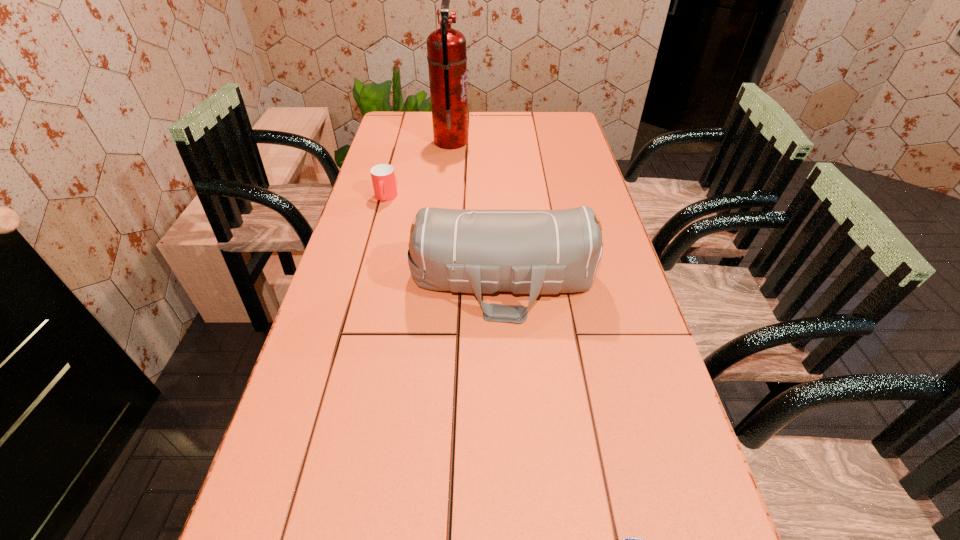
Select which object is the closest to the farthest object. Please provide its 2D coordinates. Your answer should be formatted as a tuple, i.e. [(x, y)], where the tuple contains the x and y coordinates of a point satisfying the conditions above.

[(383, 177)]

Where is `free space that satisfies the following two spatial constraints: 1. on the side of the farthest object with the handle and hose; 2. on the right side of the third shortest object`? Image resolution: width=960 pixels, height=540 pixels. free space that satisfies the following two spatial constraints: 1. on the side of the farthest object with the handle and hose; 2. on the right side of the third shortest object is located at coordinates (437, 281).

Image resolution: width=960 pixels, height=540 pixels. What are the coordinates of `vacant space that satisfies the following two spatial constraints: 1. on the side of the duffel bag with the handle and hose; 2. on the left side of the fire extinguisher` in the screenshot? It's located at (437, 281).

At what (x,y) coordinates should I click in order to perform the action: click on free location that satisfies the following two spatial constraints: 1. on the back side of the third farthest object; 2. on the side of the farthest object with the handle and hose. Please return your answer as a coordinate pair (x, y). Looking at the image, I should click on (496, 142).

I want to click on vacant area in the image that satisfies the following two spatial constraints: 1. on the side of the third farthest object with the handle and hose; 2. on the left side of the fire extinguisher, so click(437, 281).

Identify the location of free location that satisfies the following two spatial constraints: 1. on the side of the second tallest object with the handle and hose; 2. on the left side of the fire extinguisher. This screenshot has width=960, height=540. (437, 281).

Locate an element on the screen. vacant space that satisfies the following two spatial constraints: 1. on the side of the third nearest object with the handle; 2. on the right side of the duffel bag is located at coordinates click(x=363, y=281).

You are a GUI agent. You are given a task and a screenshot of the screen. Output one action in this format:
    pyautogui.click(x=<x>, y=<y>)
    Task: Click on the vacant space that satisfies the following two spatial constraints: 1. on the side of the tallest object with the handle and hose; 2. on the side of the second farthest object with the handle
    The image size is (960, 540).
    Given the screenshot: What is the action you would take?
    pyautogui.click(x=445, y=198)